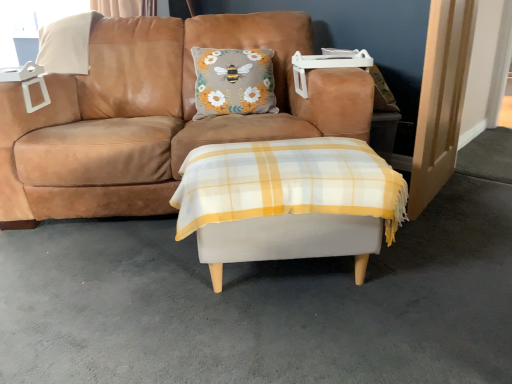
This screenshot has height=384, width=512. Find the location of `vacant space in front of light wood door at right`. vacant space in front of light wood door at right is located at coordinates (460, 235).